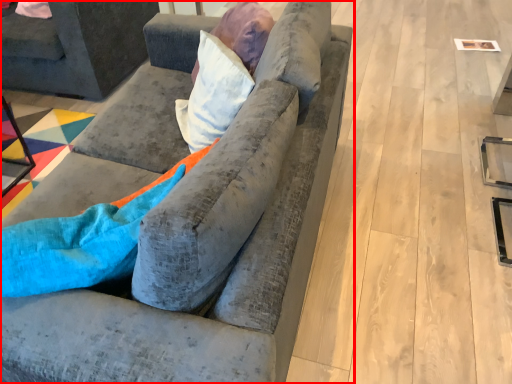
Question: From the image's perspective, what is the correct spatial positioning of studio couch (annotated by the red box) in reference to studio couch?

Choices:
 (A) above
 (B) below

Answer: (B)